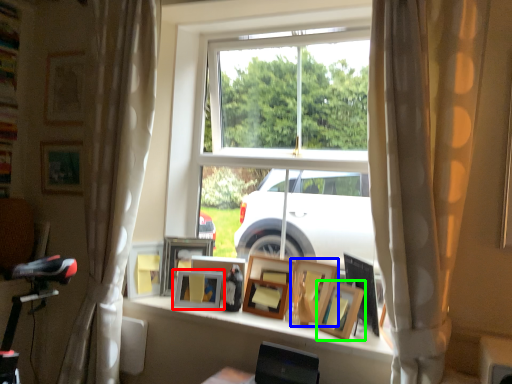
Question: Which object is the farthest from picture frame (highlighted by a red box)? Choose among these: picture frame (highlighted by a blue box) or picture frame (highlighted by a green box).

Choices:
 (A) picture frame
 (B) picture frame

Answer: (B)